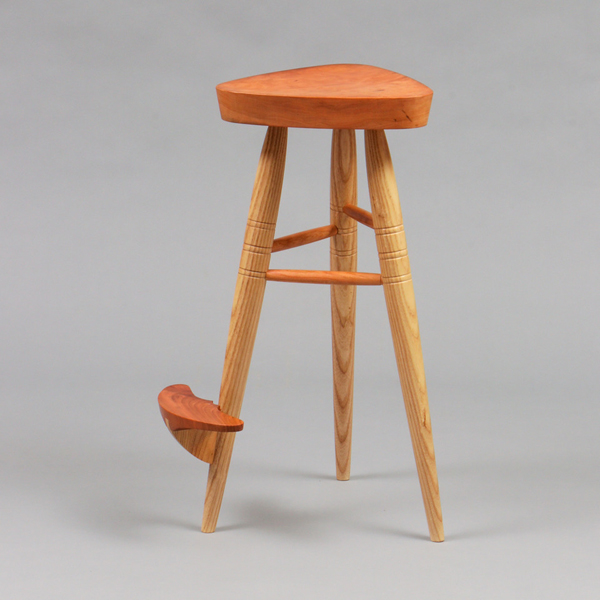
Locate an element on the screen. foot rest right is located at coordinates (365, 215).